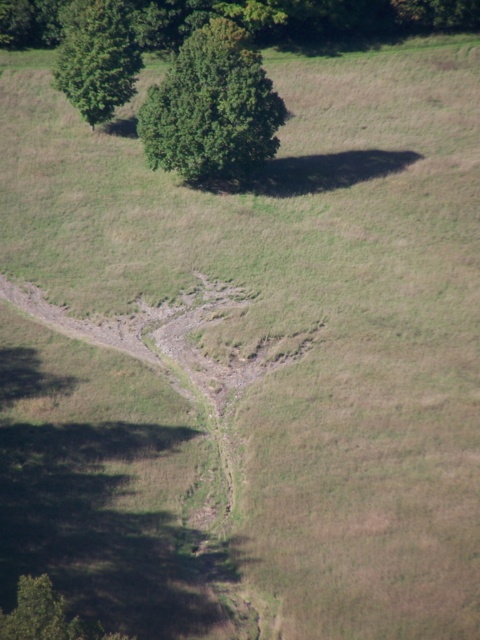
You are standing at the bottom of the dirt path and see the green matte tree at upper center and the green leafy tree at upper left. Which tree is positioned to the right when looking towards the upper part of the image?

The green matte tree at upper center is positioned to the right of the green leafy tree at upper left.

You are a hiker trying to decide which path to take in the rural landscape. You notice the green matte tree at upper center and the green leafy tree at upper left. Which tree would you use as a landmark to determine your direction, and why?

You should use the green matte tree at upper center as a landmark because it is larger in size compared to the green leafy tree at upper left, making it more visible and easier to identify from a distance.

You are a hiker who wants to take a shortcut through the trees. Which tree, the green matte tree at upper center or the green leafy tree at upper left, is located beneath the other?

The green matte tree at upper center is positioned under green leafy tree at upper left, so it is located beneath the other.